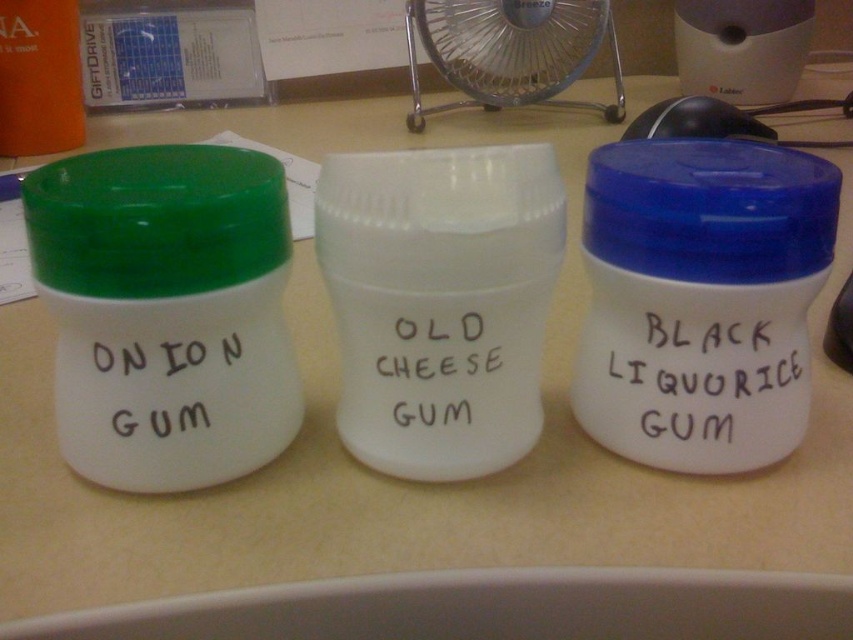
Which is behind, point (120, 404) or point (482, 316)?

The point (120, 404) is behind.

Which is above, black handwritten text at center or white matte text at center?

Positioned higher is white matte text at center.

Who is more distant from viewer, (195, 426) or (444, 348)?

The point (195, 426) is more distant.

I want to click on black handwritten text at center, so click(x=165, y=384).

Is blue plastic lid at center closer to camera compared to black matte gum at center?

Yes, it is.

Can you confirm if blue plastic lid at center is wider than black matte gum at center?

Correct, the width of blue plastic lid at center exceeds that of black matte gum at center.

Locate an element on the screen. blue plastic lid at center is located at coordinates (711, 209).

The height and width of the screenshot is (640, 853). What are the coordinates of `blue plastic lid at center` in the screenshot? It's located at (711, 209).

Which is behind, point (148, 241) or point (729, 134)?

Point (729, 134)

Does green matte lid at left have a greater height compared to black plastic mouse at upper center?

In fact, green matte lid at left may be shorter than black plastic mouse at upper center.

Measure the distance between green matte lid at left and camera.

The distance of green matte lid at left from camera is 15.76 inches.

Locate an element on the screen. The height and width of the screenshot is (640, 853). green matte lid at left is located at coordinates (155, 220).